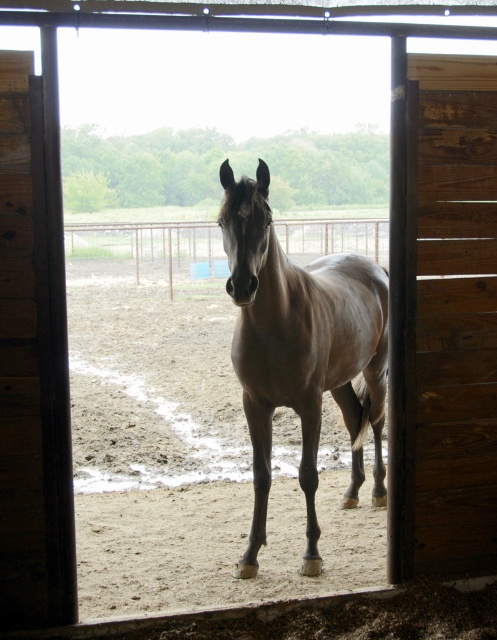
You are standing outside the stable and want to enter. The brown wooden door at right and the brown glossy horse at center are in your view. Which object is higher from the ground?

The brown wooden door at right is above the brown glossy horse at center, so the brown wooden door at right is higher from the ground.

You are standing inside the stable and want to exit through the brown wooden door at right. Based on the scene description, where should you walk to find the door?

The brown wooden door at right is located at point (444, 321), so you should walk towards the right side of the stable near the lower part of the doorway to find the door.